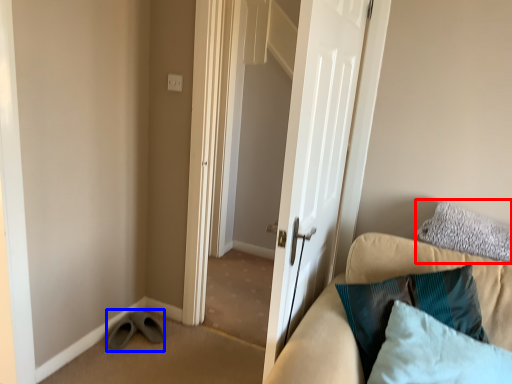
Question: Which object appears closest to the camera in this image, pillow (highlighted by a red box) or shoe (highlighted by a blue box)?

Choices:
 (A) pillow
 (B) shoe

Answer: (A)